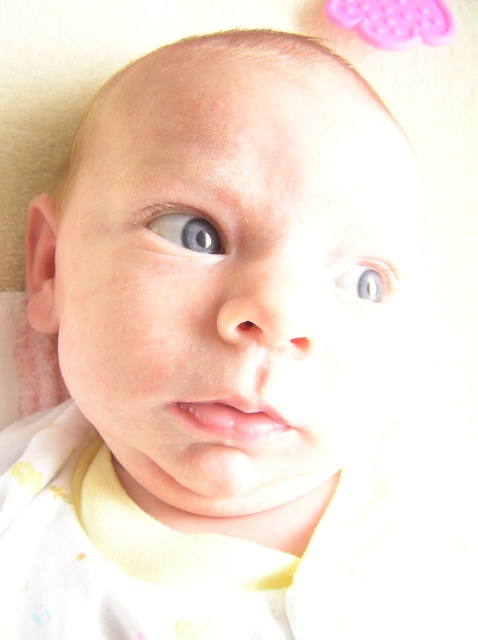
Based on the photo, is blue glossy eye at upper left below blue glossy eye at upper center?

Actually, blue glossy eye at upper left is above blue glossy eye at upper center.

Does blue glossy eye at upper left appear on the right side of blue glossy eye at upper center?

Incorrect, blue glossy eye at upper left is not on the right side of blue glossy eye at upper center.

The image size is (478, 640). What are the coordinates of `blue glossy eye at upper left` in the screenshot? It's located at (187, 230).